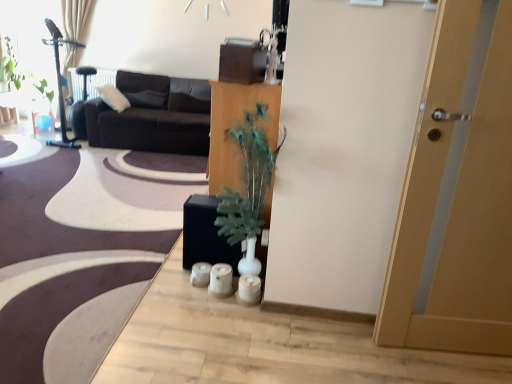
At what (x,y) coordinates should I click in order to perform the action: click on free space that is to the left of light brown wood door at right. Please return your answer as a coordinate pair (x, y). This screenshot has width=512, height=384. Looking at the image, I should click on click(350, 346).